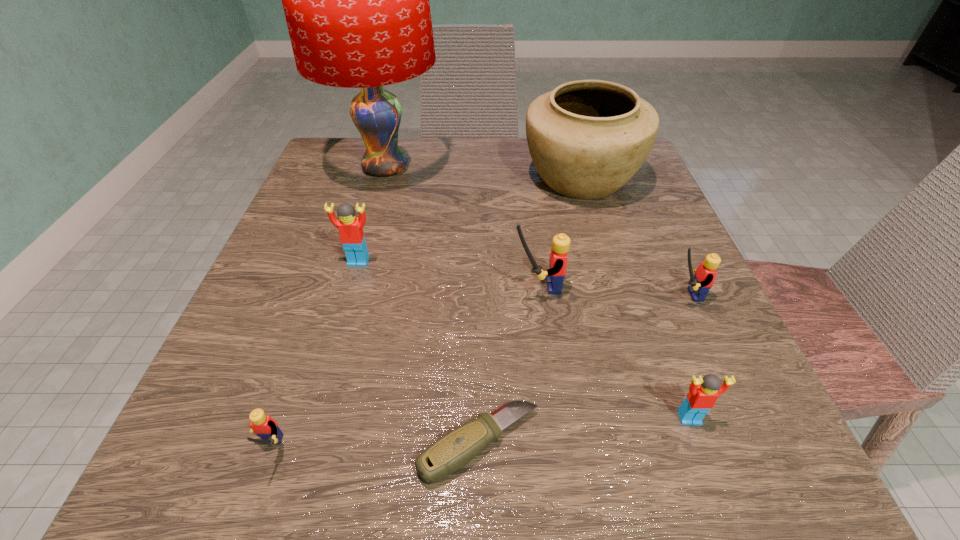
Identify the location of the closest object to the second biggest yellow Lego. (558, 258).

The image size is (960, 540). I want to click on object that stands as the closest to the second Lego from right to left, so click(452, 451).

Identify the location of the fourth closest Lego to the gray pocketknife. (699, 284).

Point out which Lego is positioned as the second nearest to the gray pocketknife. Please provide its 2D coordinates. Your answer should be formatted as a tuple, i.e. [(x, y)], where the tuple contains the x and y coordinates of a point satisfying the conditions above.

[(703, 393)]

Identify which yellow Lego is located as the second nearest to the tallest Lego. Please provide its 2D coordinates. Your answer should be formatted as a tuple, i.e. [(x, y)], where the tuple contains the x and y coordinates of a point satisfying the conditions above.

[(265, 427)]

At what (x,y) coordinates should I click in order to perform the action: click on yellow Lego that is the closest to the bigger red Lego. Please return your answer as a coordinate pair (x, y). Looking at the image, I should click on (558, 258).

Image resolution: width=960 pixels, height=540 pixels. I want to click on free space that satisfies the following two spatial constraints: 1. on the front-facing side of the third tallest object; 2. on the front-facing side of the leftmost yellow Lego, so click(557, 453).

At what (x,y) coordinates should I click in order to perform the action: click on free space that satisfies the following two spatial constraints: 1. on the front-facing side of the tallest object; 2. on the front-facing side of the nearest yellow Lego. Please return your answer as a coordinate pair (x, y). Image resolution: width=960 pixels, height=540 pixels. Looking at the image, I should click on (304, 453).

The height and width of the screenshot is (540, 960). What are the coordinates of `free space that satisfies the following two spatial constraints: 1. on the front-facing side of the sixth shortest object; 2. on the front-facing side of the nearest Lego` in the screenshot? It's located at (557, 453).

Image resolution: width=960 pixels, height=540 pixels. What are the coordinates of `free space that satisfies the following two spatial constraints: 1. on the front-facing side of the tallest object; 2. on the left side of the second tallest object` in the screenshot? It's located at (383, 177).